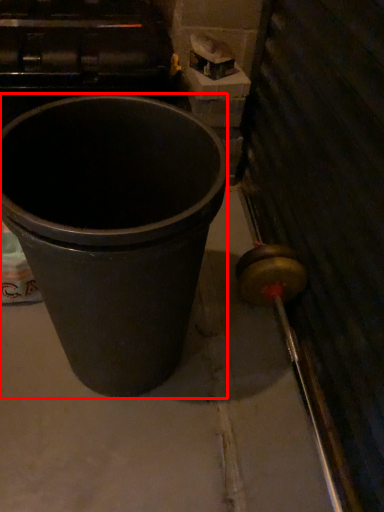
Question: In this image, where is waste container (annotated by the red box) located relative to concrete?

Choices:
 (A) right
 (B) left

Answer: (B)